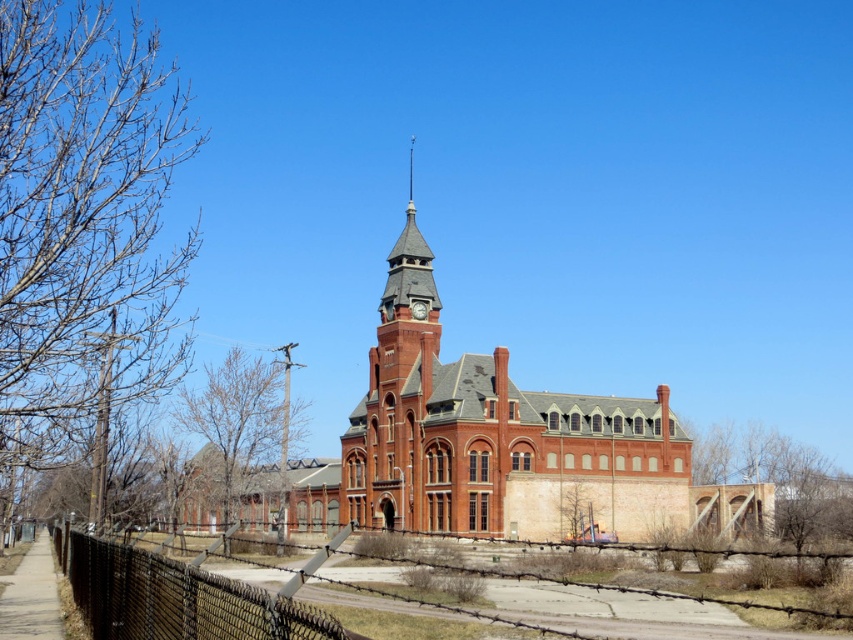
Question: Is red brick church at center further to camera compared to chain-link fence at lower left?

Choices:
 (A) yes
 (B) no

Answer: (A)

Question: Where is red brick church at center located in relation to chain-link fence at lower left in the image?

Choices:
 (A) above
 (B) below

Answer: (A)

Question: Is red brick church at center positioned at the back of chain-link fence at lower left?

Choices:
 (A) no
 (B) yes

Answer: (B)

Question: Which of the following is the closest to the observer?

Choices:
 (A) chain-link fence at lower left
 (B) red brick church at center
 (C) black chain-link fence at lower left

Answer: (A)

Question: Which of the following is the farthest from the observer?

Choices:
 (A) black chain-link fence at lower left
 (B) matte gray clock at center
 (C) red brick church at center
 (D) chain-link fence at lower left

Answer: (B)

Question: Which point is farther to the camera?

Choices:
 (A) chain-link fence at lower left
 (B) black chain-link fence at lower left
 (C) red brick church at center

Answer: (C)